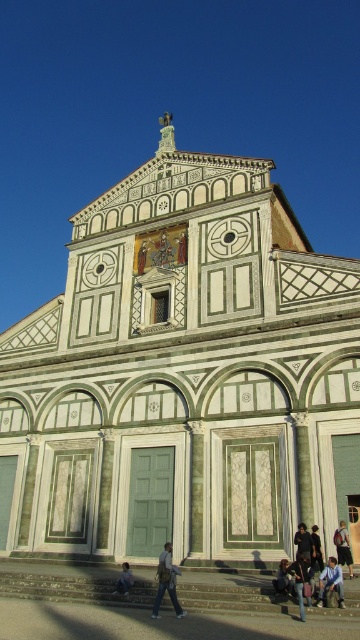
You are a tailor who needs to determine which pair of jeans has more fabric to work with based on their size. Given that you see both the blue denim jeans at lower right and the light blue jeans at lower center in the image, which pair should you choose?

The blue denim jeans at lower right is larger in size than the light blue jeans at lower center, so the tailor should choose the blue denim jeans at lower right as it has more fabric available.